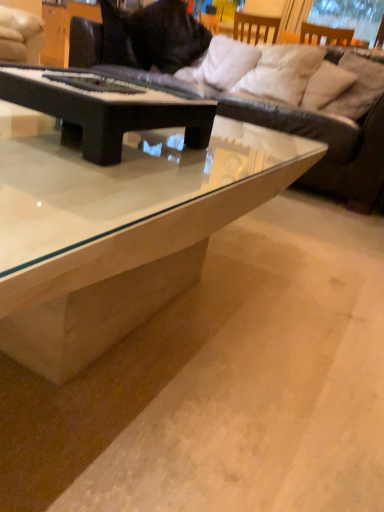
Question: Is point (62, 289) closer or farther from the camera than point (301, 66)?

Choices:
 (A) farther
 (B) closer

Answer: (B)

Question: Considering the positions of transparent glass coffee table at center, the second coffee table in the back-to-front sequence, and white soft pillow at upper right, marked as the second pillow in a left-to-right arrangement, in the image, is transparent glass coffee table at center, the second coffee table in the back-to-front sequence, bigger or smaller than white soft pillow at upper right, marked as the second pillow in a left-to-right arrangement,?

Choices:
 (A) big
 (B) small

Answer: (A)

Question: Estimate the real-world distances between objects in this image. Which object is farther from the white soft pillow at upper right, marked as the second pillow in a left-to-right arrangement?

Choices:
 (A) white soft pillow at upper center, placed as the fourth pillow when sorted from right to left
 (B) beige fabric pillow at upper right, which appears as the 4th pillow when viewed from the left
 (C) black matte piano at center, which appears as the 2th coffee table when viewed from the front
 (D) black leather couch at upper center
 (E) transparent glass coffee table at center, which is the first coffee table in front-to-back order

Answer: (C)

Question: Considering the real-world distances, which object is closest to the beige fabric pillow at upper right, which appears as the 4th pillow when viewed from the left?

Choices:
 (A) white soft pillow at upper center, placed as the fourth pillow when sorted from right to left
 (B) white soft pillow at upper right, placed as the second pillow when sorted from right to left
 (C) black leather couch at upper center
 (D) transparent glass coffee table at center, which is the first coffee table in front-to-back order
 (E) white soft pillow at upper right, marked as the third pillow in a right-to-left arrangement

Answer: (B)